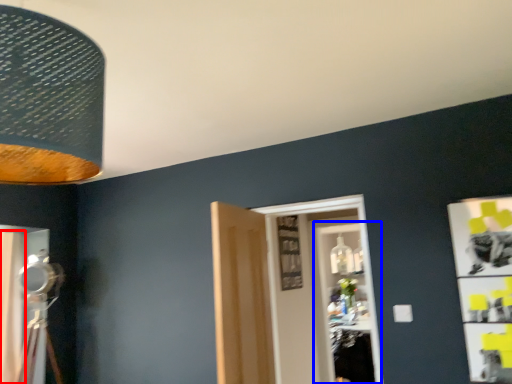
Question: Among these objects, which one is nearest to the camera, curtain (highlighted by a red box) or glass door (highlighted by a blue box)?

Choices:
 (A) curtain
 (B) glass door

Answer: (A)